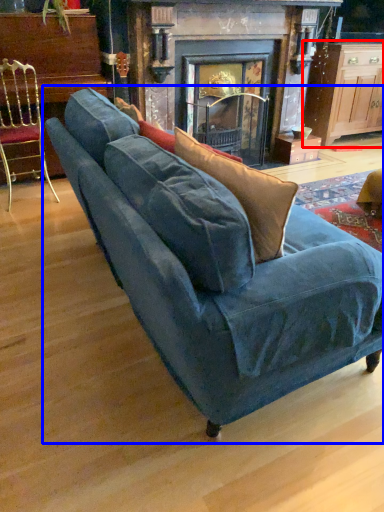
Question: Which object is closer to the camera taking this photo, table (highlighted by a red box) or studio couch (highlighted by a blue box)?

Choices:
 (A) table
 (B) studio couch

Answer: (B)